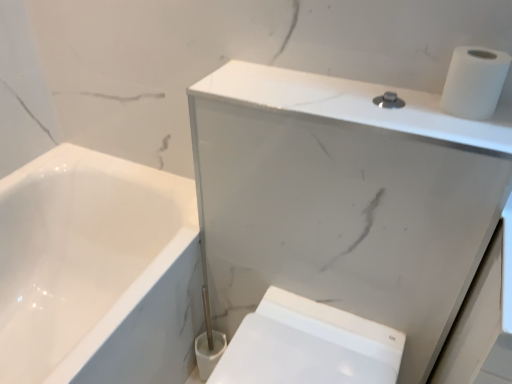
Find the location of a particular element. This screenshot has height=384, width=512. free space to the left of white matte toilet paper at upper right is located at coordinates (382, 102).